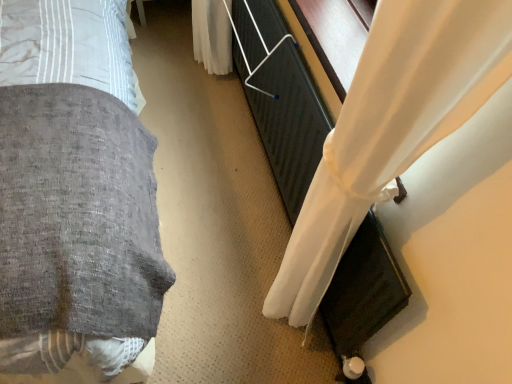
In order to click on free space in front of white sheer curtain at right in this screenshot , I will do `click(237, 253)`.